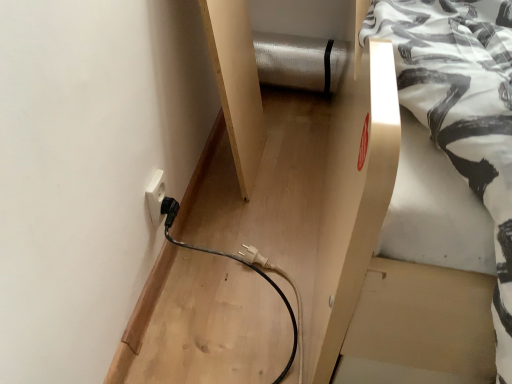
What do you see at coordinates (155, 197) in the screenshot? The width and height of the screenshot is (512, 384). I see `white plastic electric outlet at lower left` at bounding box center [155, 197].

The image size is (512, 384). I want to click on white plastic electric outlet at lower left, so click(x=155, y=197).

Find the location of a particular element. This screenshot has height=384, width=512. white plastic electric outlet at lower left is located at coordinates (155, 197).